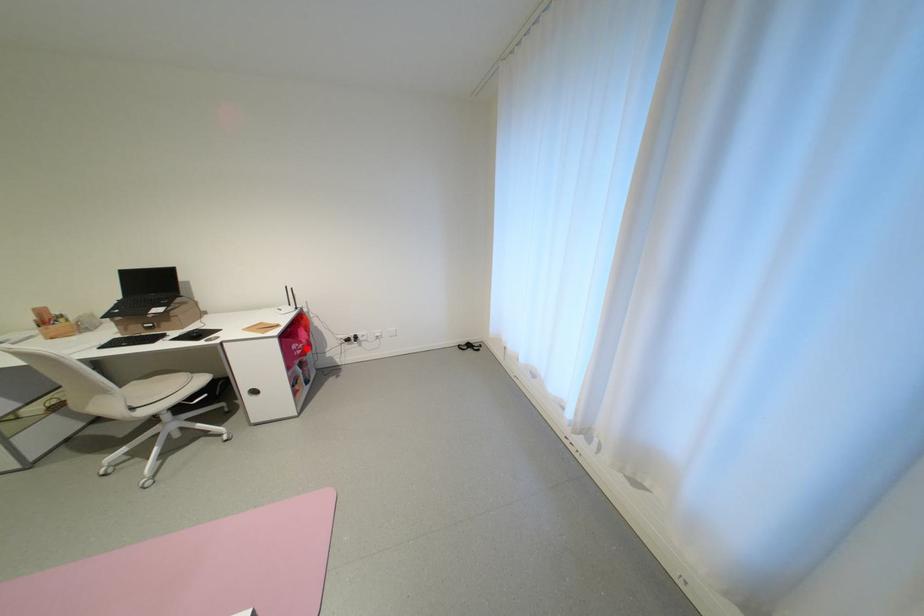
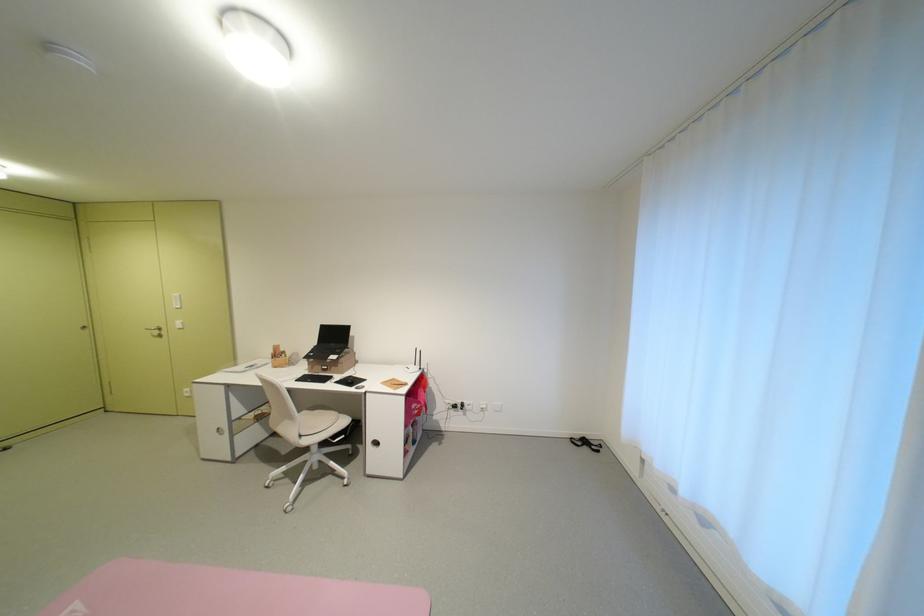
Question: I am providing you with two images of the same scene from different viewpoints. Given a red point in image1, look at the same physical point in image2. Is it:

Choices:
 (A) Closer to the viewpoint
 (B) Farther from the viewpoint

Answer: (B)